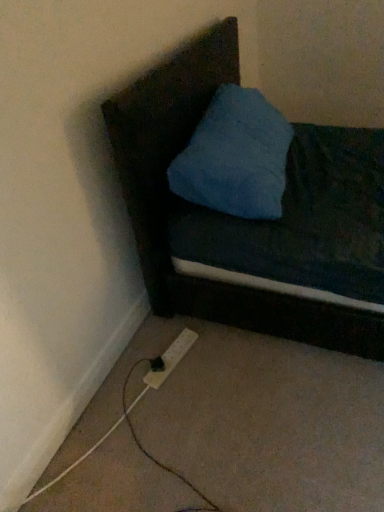
Identify the location of unoccupied area behind white plastic power plugs and sockets at lower left. click(158, 328).